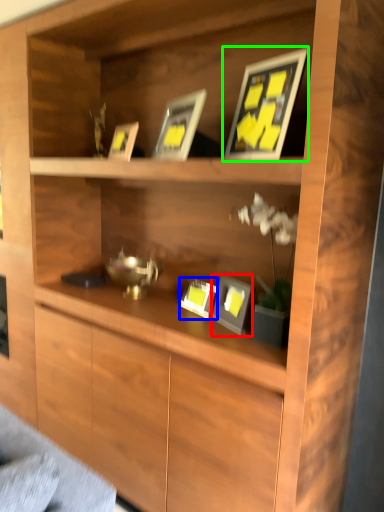
Question: Estimate the real-world distances between objects in this image. Which object is farther from picture frame (highlighted by a red box), picture frame (highlighted by a blue box) or picture frame (highlighted by a green box)?

Choices:
 (A) picture frame
 (B) picture frame

Answer: (B)